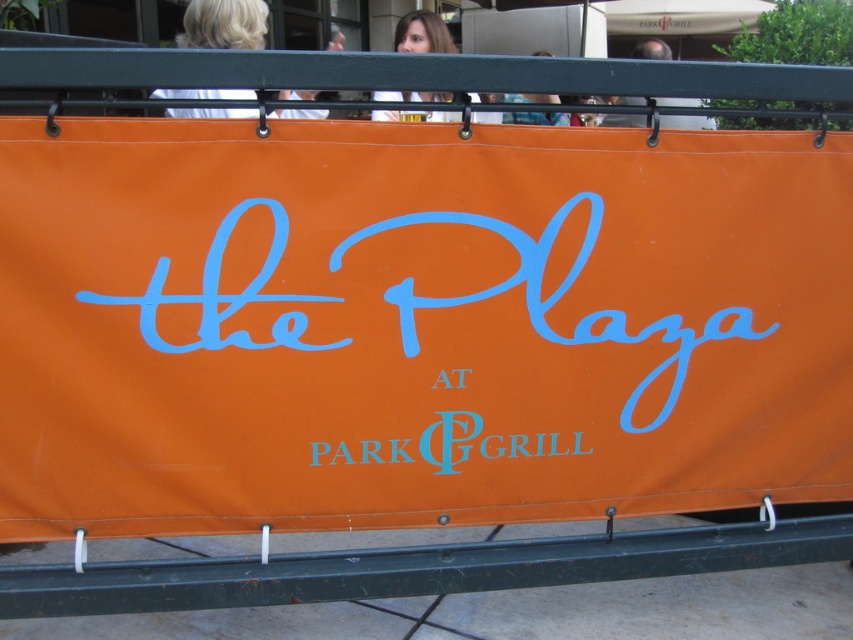
Question: Is blonde hair at upper center closer to the viewer compared to smooth skin head at upper center?

Choices:
 (A) yes
 (B) no

Answer: (A)

Question: Which of the following is the closest to the observer?

Choices:
 (A) (352, 454)
 (B) (425, 44)
 (C) (541, 51)
 (D) (90, 214)

Answer: (D)

Question: Considering the real-world distances, which object is closest to the blonde hair at upper center?

Choices:
 (A) smooth skin head at upper center
 (B) green metal rail at bottom
 (C) orange fabric sign at center

Answer: (A)

Question: Considering the real-world distances, which object is farthest from the bluecursive text at center?

Choices:
 (A) matte black hair at upper center
 (B) orange fabric sign at center
 (C) smooth skin head at upper center

Answer: (C)

Question: Is bluecursive text at center positioned in front of blonde hair at upper left?

Choices:
 (A) no
 (B) yes

Answer: (A)

Question: Does bluecursive text at center lie in front of matte black hair at upper center?

Choices:
 (A) yes
 (B) no

Answer: (B)